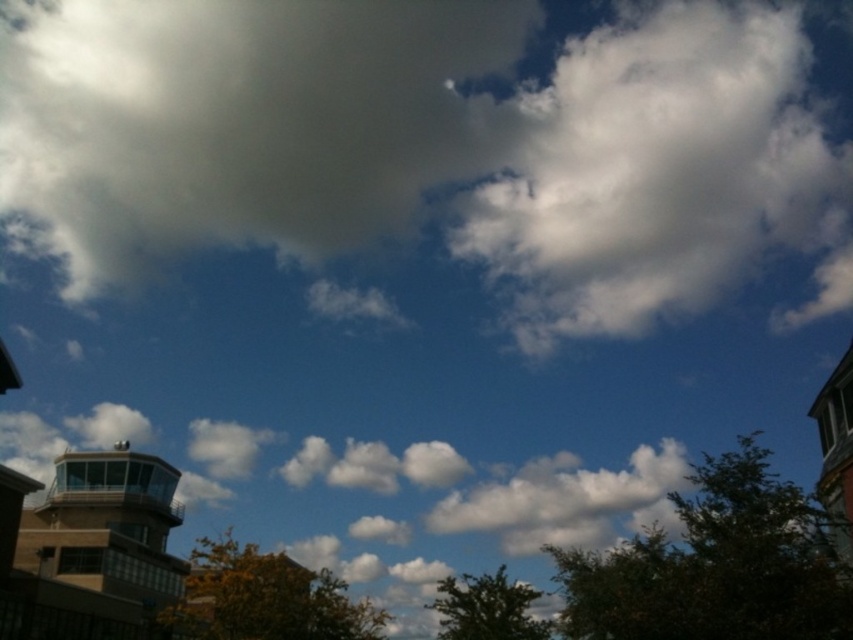
You are an astronomer analyzing the sky. You notice the white fluffy cloud at upper center. Where exactly is it located in the image?

The white fluffy cloud at upper center is located at point 0.194 on the x axis and 0.281 on the y axis.

You are standing in the foreground of the image and see the point labeled as point (x=97, y=548). Based on the scene description, what object does this point most likely belong to?

The point (x=97, y=548) corresponds to the brown glass tower at lower left.

You are an architect planning to build a new skyscraper that needs to be visible from the city park. The park has a brown glass tower at lower left and a white fluffy cloud at center in the background. Which object should you consider for visibility planning, and why?

You should consider the white fluffy cloud at center because it occupies more space than the brown glass tower at lower left, making it a more prominent feature in the background for visibility planning.